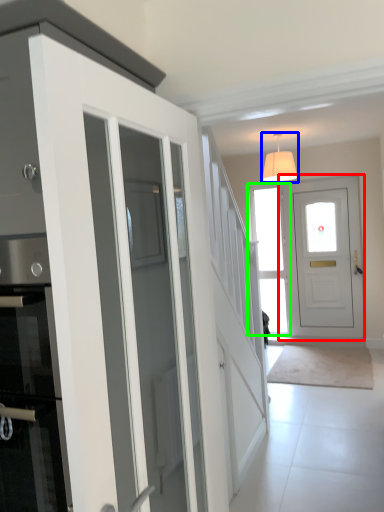
Question: Considering the real-world distances, which object is farthest from door (highlighted by a red box)? lamp (highlighted by a blue box) or window (highlighted by a green box)?

Choices:
 (A) lamp
 (B) window

Answer: (A)